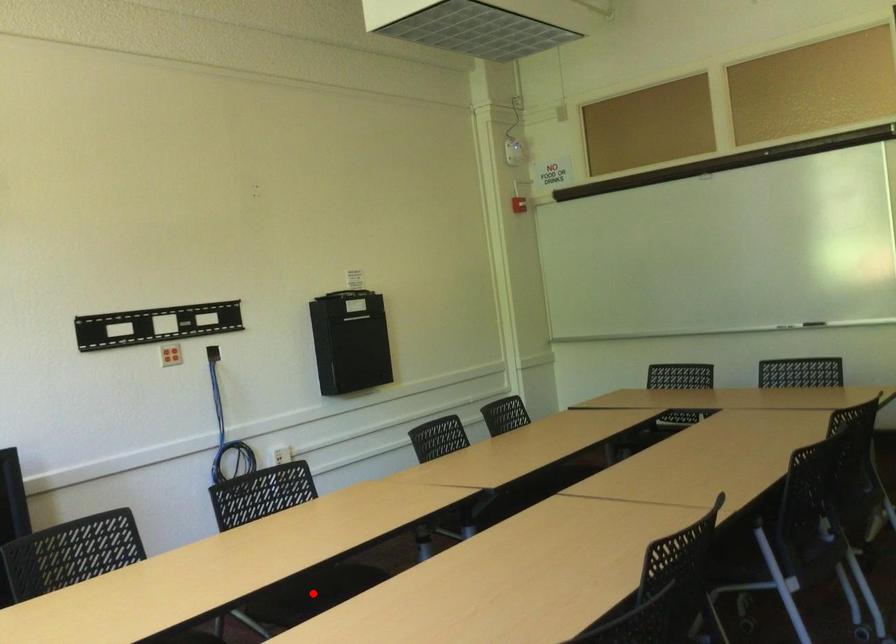
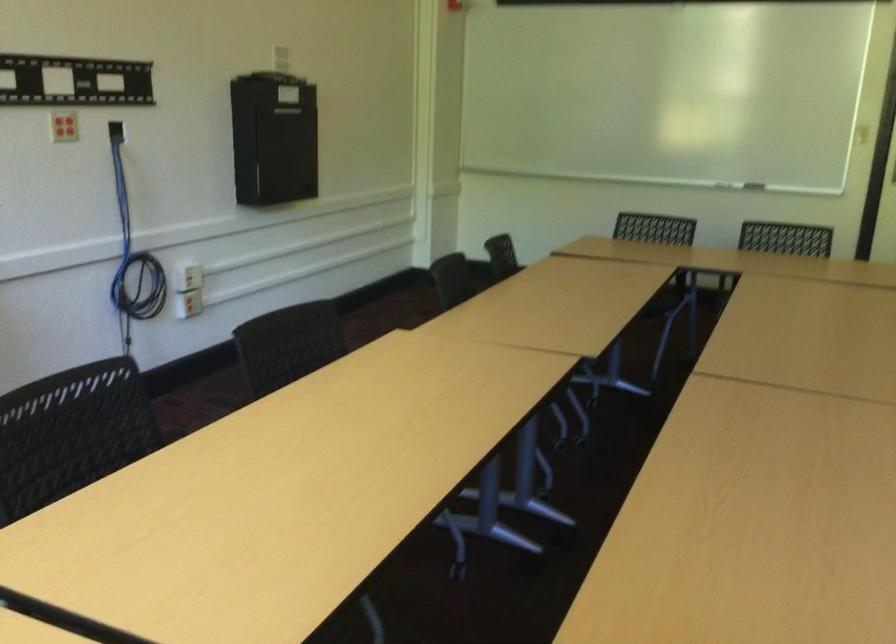
Question: I am providing you with two images of the same scene from different viewpoints. A red point is marked on the first image. At the location where the point appears in image 1, is it still visible in image 2?

Choices:
 (A) Yes
 (B) No

Answer: (B)